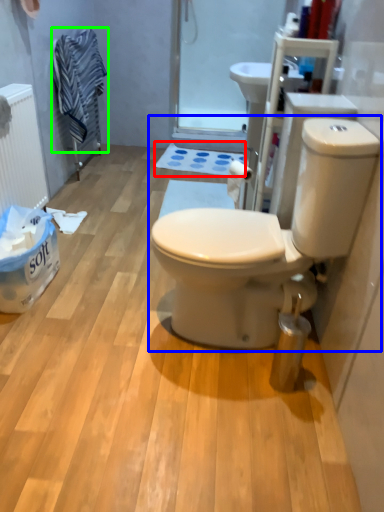
Question: Estimate the real-world distances between objects in this image. Which object is farther from bath mat (highlighted by a red box), toilet (highlighted by a blue box) or laundry (highlighted by a green box)?

Choices:
 (A) toilet
 (B) laundry

Answer: (A)